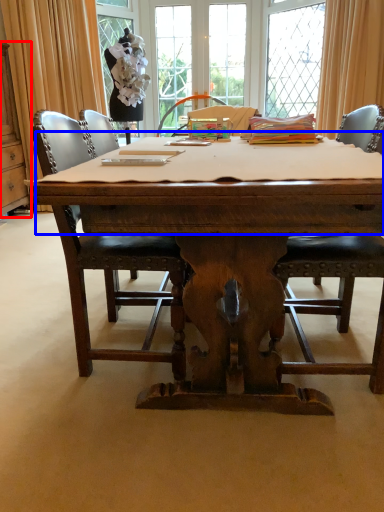
Question: Among these objects, which one is farthest to the camera, cabinetry (highlighted by a red box) or tablecloth (highlighted by a blue box)?

Choices:
 (A) cabinetry
 (B) tablecloth

Answer: (A)